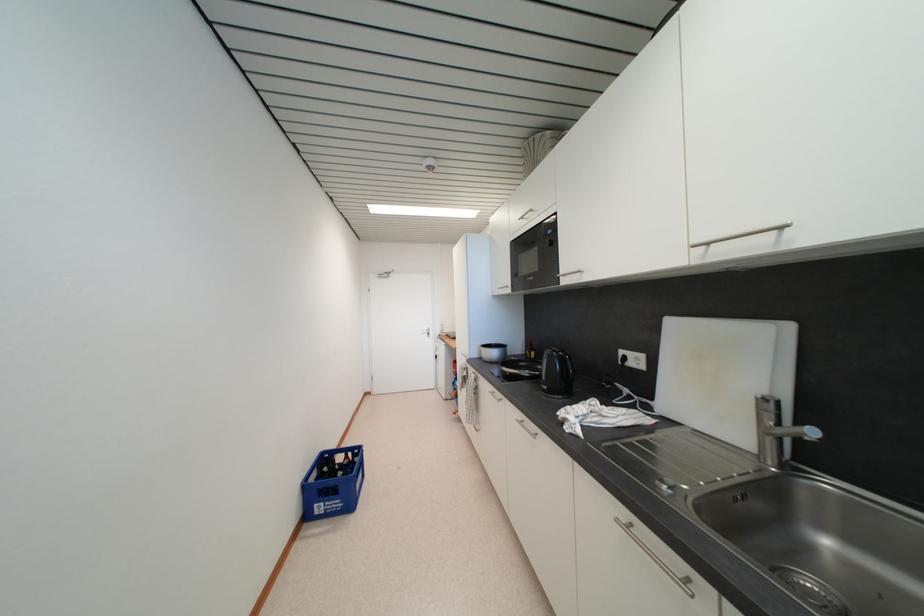
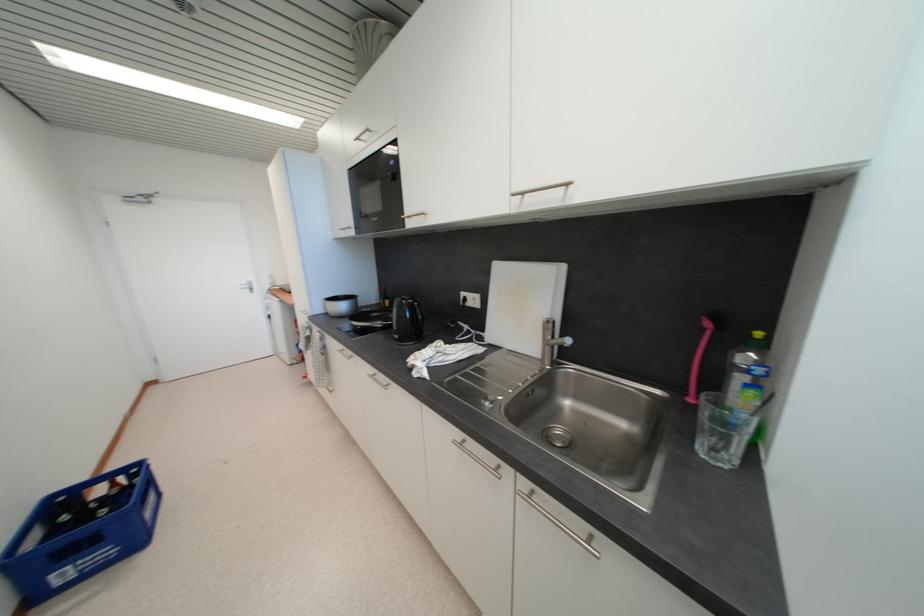
Where in the second image is the point corresponding to pixel 812 440 from the first image?

(570, 347)